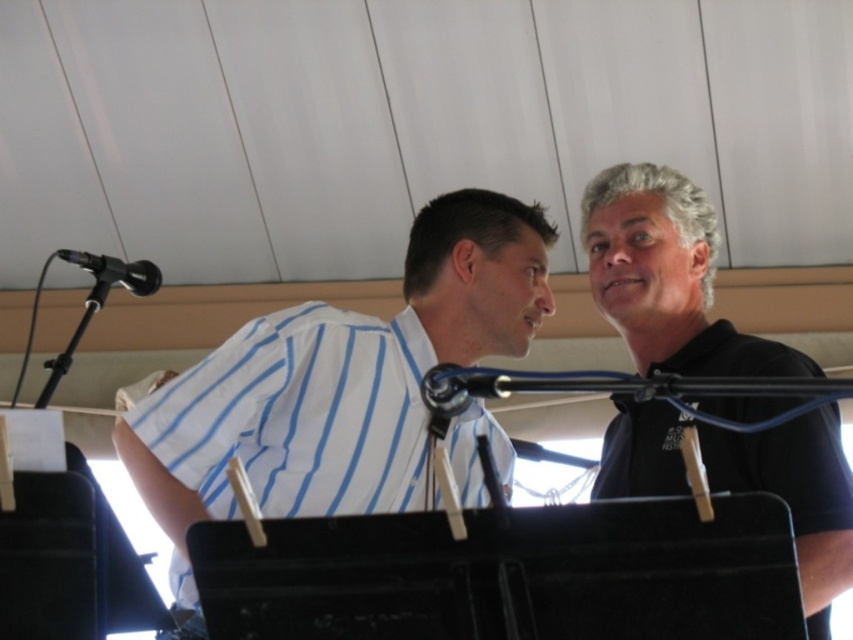
You are an event organizer setting up a stage. You need to ensure that the white striped shirt at center and the black metallic microphone at upper left are visible to the audience. Based on their positions, which object is closer to the front of the stage?

The white striped shirt at center is positioned under the black metallic microphone at upper left, meaning the white striped shirt at center is closer to the front of the stage since it is below the microphone.

You are a photographer setting up for a live event. You need to position a spotlight so it illuminates both the black matte shirt at upper right and the black metallic microphone at upper left. Since the microphone is metallic, it might reflect light differently. Considering their positions, which object should you aim the spotlight closer to first to ensure both are properly lit?

The black matte shirt at upper right is positioned on the right side of black metallic microphone at upper left. Since the microphone is metallic and reflects light more, you should aim the spotlight closer to the black metallic microphone at upper left first. This way, the light will bounce off the microphone and also reach the shirt on its right side, ensuring both are illuminated properly.

You are a photographer setting up for a group photo. You need to ensure that the white striped shirt at center and the black metallic microphone at upper left are both in frame. Based on their heights, which object should you adjust your camera angle to focus on first?

The white striped shirt at center is taller than the black metallic microphone at upper left, so you should focus on the white striped shirt at center first to ensure proper framing.